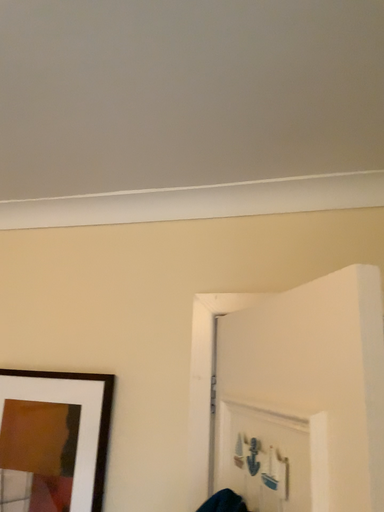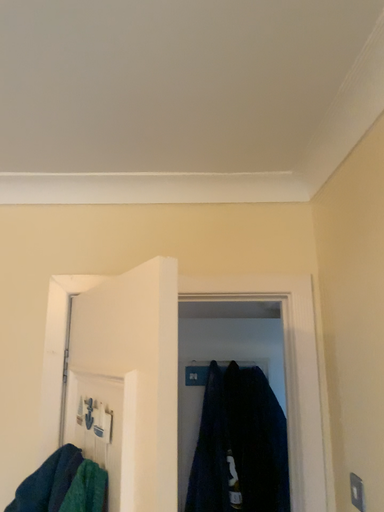
Question: How did the camera likely rotate when shooting the video?

Choices:
 (A) rotated right
 (B) rotated left

Answer: (A)